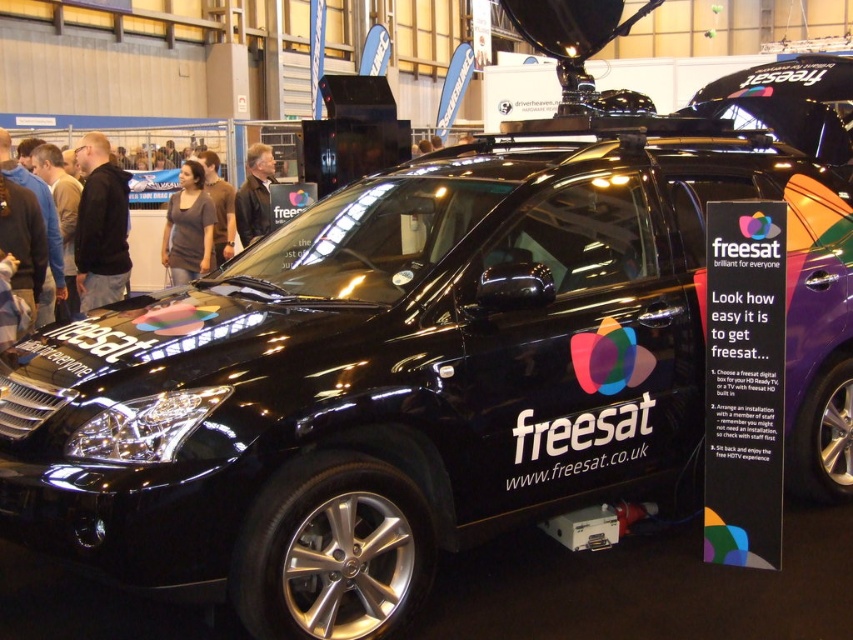
Question: Does black hoodie at center have a greater width compared to gray matte shirt at center?

Choices:
 (A) no
 (B) yes

Answer: (A)

Question: Which object is positioned closest to the black hoodie at center?

Choices:
 (A) leather jacket at center
 (B) gray matte shirt at center

Answer: (B)

Question: Which object is closer to the camera taking this photo?

Choices:
 (A) brownmaterial/textureshirt at center
 (B) black hoodie at center

Answer: (B)

Question: Among these objects, which one is nearest to the camera?

Choices:
 (A) gray matte shirt at center
 (B) black hoodie at center
 (C) leather jacket at center
 (D) brownmaterial/textureshirt at center

Answer: (B)

Question: Can you confirm if leather jacket at center is smaller than brownmaterial/textureshirt at center?

Choices:
 (A) yes
 (B) no

Answer: (A)

Question: Can you confirm if gray matte shirt at center is positioned to the left of brownmaterial/textureshirt at center?

Choices:
 (A) yes
 (B) no

Answer: (A)